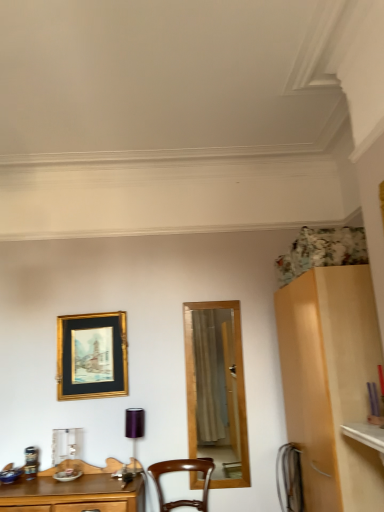
Question: From a real-world perspective, is gold/glossy picture frame at upper left located beneath purple metallic lamp at center?

Choices:
 (A) yes
 (B) no

Answer: (B)

Question: Is gold/glossy picture frame at upper left wider than purple metallic lamp at center?

Choices:
 (A) yes
 (B) no

Answer: (B)

Question: Does gold/glossy picture frame at upper left have a lesser width compared to purple metallic lamp at center?

Choices:
 (A) yes
 (B) no

Answer: (A)

Question: Is gold/glossy picture frame at upper left to the left of purple metallic lamp at center from the viewer's perspective?

Choices:
 (A) yes
 (B) no

Answer: (A)

Question: Does gold/glossy picture frame at upper left have a larger size compared to purple metallic lamp at center?

Choices:
 (A) yes
 (B) no

Answer: (A)

Question: Is gold/glossy picture frame at upper left facing towards purple metallic lamp at center?

Choices:
 (A) yes
 (B) no

Answer: (B)

Question: Can you confirm if purple metallic lamp at center is wider than brown wooden chair at center?

Choices:
 (A) no
 (B) yes

Answer: (A)

Question: Is purple metallic lamp at center shorter than brown wooden chair at center?

Choices:
 (A) yes
 (B) no

Answer: (B)

Question: Are purple metallic lamp at center and brown wooden chair at center located far from each other?

Choices:
 (A) no
 (B) yes

Answer: (A)

Question: Is purple metallic lamp at center taller than brown wooden chair at center?

Choices:
 (A) yes
 (B) no

Answer: (A)

Question: Is purple metallic lamp at center further to the viewer compared to brown wooden chair at center?

Choices:
 (A) yes
 (B) no

Answer: (A)

Question: Can you confirm if purple metallic lamp at center is positioned to the left of brown wooden chair at center?

Choices:
 (A) yes
 (B) no

Answer: (A)

Question: Does brown wooden chair at center contain gold/glossy picture frame at upper left?

Choices:
 (A) yes
 (B) no

Answer: (B)